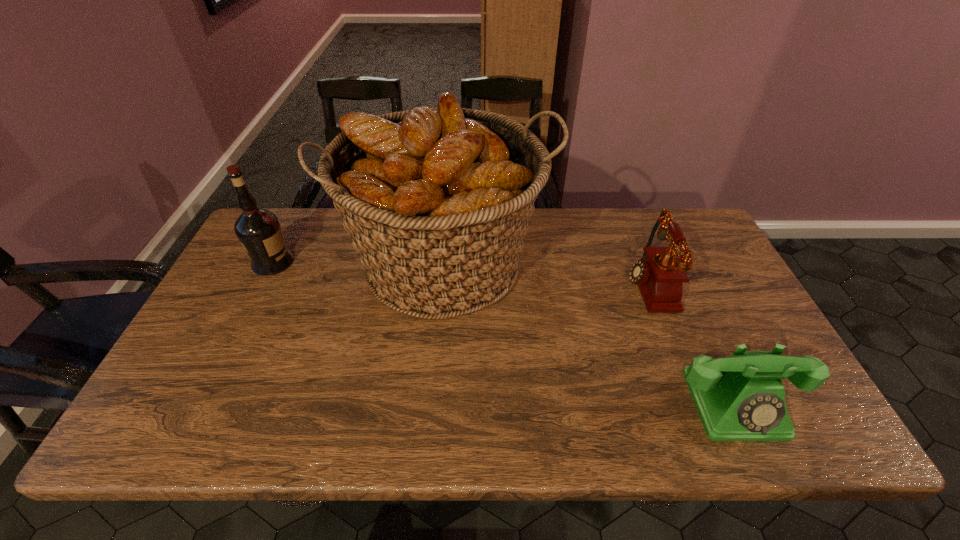
This screenshot has height=540, width=960. I want to click on free space between the third tallest object and the nearer telephone, so click(x=690, y=344).

Locate an element on the screen. The image size is (960, 540). free spot between the tallest object and the nearer telephone is located at coordinates (591, 333).

The height and width of the screenshot is (540, 960). In order to click on object that is the third closest to the shorter telephone in this screenshot , I will do `click(258, 230)`.

Choose which object is the nearest neighbor to the shortest object. Please provide its 2D coordinates. Your answer should be formatted as a tuple, i.e. [(x, y)], where the tuple contains the x and y coordinates of a point satisfying the conditions above.

[(660, 273)]

Where is `vacant position in the image that satisfies the following two spatial constraints: 1. on the surface of the tallest object; 2. on the left side of the second tallest object`? vacant position in the image that satisfies the following two spatial constraints: 1. on the surface of the tallest object; 2. on the left side of the second tallest object is located at coordinates (273, 263).